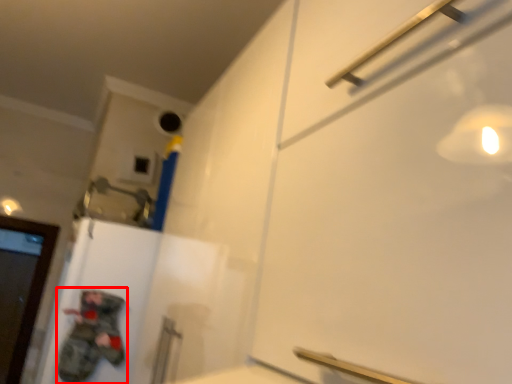
Question: From the image's perspective, what is the correct spatial relationship of person (annotated by the red box) in relation to door?

Choices:
 (A) below
 (B) above

Answer: (B)